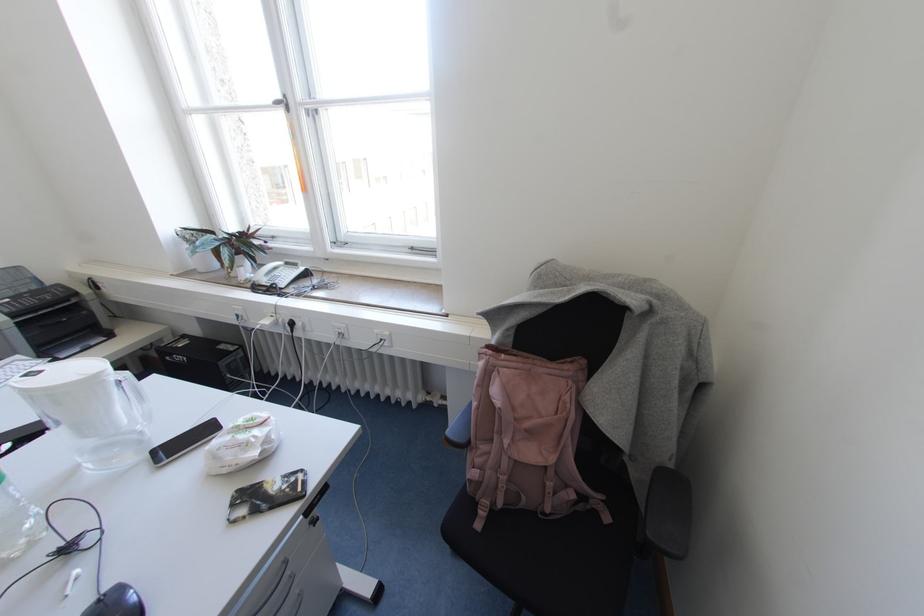
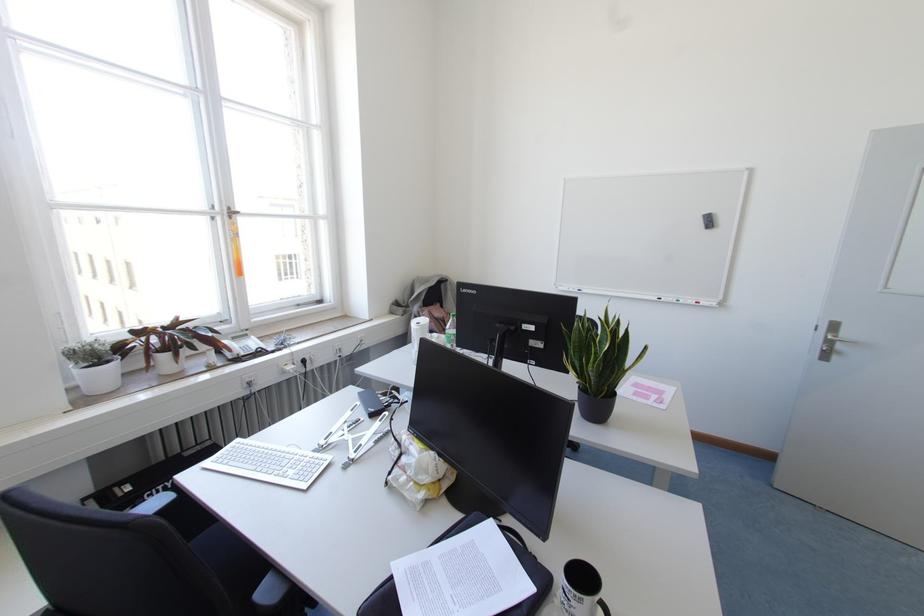
The point at (x=274, y=285) is marked in the first image. Where is the corresponding point in the second image?

(258, 349)